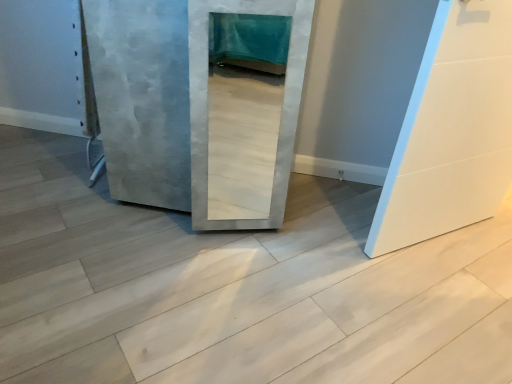
This screenshot has height=384, width=512. What are the coordinates of `vacant area situated below white matte door at right, the second door in the left-to-right sequence (from a real-world perspective)` in the screenshot? It's located at (428, 242).